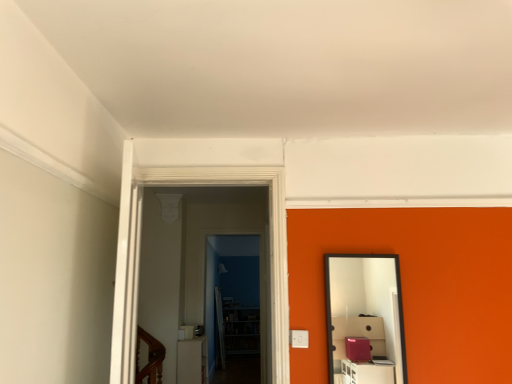
You are a GUI agent. You are given a task and a screenshot of the screen. Output one action in this format:
    pyautogui.click(x=<x>, y=<y>)
    Task: Click on the black framed mirror at right
    
    Given the screenshot: What is the action you would take?
    pyautogui.click(x=365, y=318)

What is the approximate height of transparent glass door at center, arranged as the first glass door when viewed from the back?

5.51 feet.

Measure the distance between transparent glass door at center, positioned as the 1th glass door in front-to-back order, and camera.

The depth of transparent glass door at center, positioned as the 1th glass door in front-to-back order, is 2.21 meters.

Measure the distance between point (136, 243) and camera.

Point (136, 243) is 6.19 feet away from camera.

You are a GUI agent. You are given a task and a screenshot of the screen. Output one action in this format:
    pyautogui.click(x=<x>, y=<y>)
    Task: Click on the white glossy light switch at center
    The width and height of the screenshot is (512, 384).
    Given the screenshot: What is the action you would take?
    pyautogui.click(x=192, y=360)

The height and width of the screenshot is (384, 512). What are the coordinates of `black framed mirror at right` in the screenshot? It's located at (365, 318).

Is black framed mirror at right oriented towards transparent glass door at center, arranged as the first glass door when viewed from the back?

No, black framed mirror at right does not turn towards transparent glass door at center, arranged as the first glass door when viewed from the back.

From a real-world perspective, is black framed mirror at right over transparent glass door at center, arranged as the first glass door when viewed from the back?

Yes, from a real-world perspective, black framed mirror at right is on top of transparent glass door at center, arranged as the first glass door when viewed from the back.

Based on the photo, is black framed mirror at right at the left side of transparent glass door at center, arranged as the first glass door when viewed from the back?

No, black framed mirror at right is not to the left of transparent glass door at center, arranged as the first glass door when viewed from the back.

Is black framed mirror at right shorter than transparent glass door at center, arranged as the first glass door when viewed from the back?

Correct, black framed mirror at right is not as tall as transparent glass door at center, arranged as the first glass door when viewed from the back.

Would you say white glossy light switch at center contains black framed mirror at right?

No, black framed mirror at right is not a part of white glossy light switch at center.

Is point (198, 353) farther from viewer compared to point (358, 337)?

Yes, point (198, 353) is farther from viewer.

Could you tell me if white glossy light switch at center is turned towards black framed mirror at right?

No, white glossy light switch at center is not oriented towards black framed mirror at right.

How different are the orientations of white glossy light switch at center and black framed mirror at right in degrees?

The angle between the facing direction of white glossy light switch at center and the facing direction of black framed mirror at right is 86.3 degrees.

Based on the photo, can you confirm if transparent glass door at center, arranged as the first glass door when viewed from the back, is bigger than white glossy light switch at center?

Incorrect, transparent glass door at center, arranged as the first glass door when viewed from the back, is not larger than white glossy light switch at center.

Image resolution: width=512 pixels, height=384 pixels. What are the coordinates of `furniture in front of the transparent glass door at center, arranged as the first glass door when viewed from the back` in the screenshot? It's located at (192, 360).

Which is correct: transparent glass door at center, arranged as the first glass door when viewed from the back, is inside white glossy light switch at center, or outside of it?

transparent glass door at center, arranged as the first glass door when viewed from the back, exists outside the volume of white glossy light switch at center.

Is transparent glass door at center, arranged as the first glass door when viewed from the back, taller or shorter than white glossy light switch at center?

Considering their sizes, transparent glass door at center, arranged as the first glass door when viewed from the back, has more height than white glossy light switch at center.

How many degrees apart are the facing directions of transparent glass door at center, arranged as the first glass door when viewed from the back, and black framed mirror at right?

transparent glass door at center, arranged as the first glass door when viewed from the back, and black framed mirror at right are facing 0.342 degrees away from each other.

Is transparent glass door at center, acting as the second glass door starting from the front, oriented towards black framed mirror at right?

No, transparent glass door at center, acting as the second glass door starting from the front, does not turn towards black framed mirror at right.

In the image, there is a black framed mirror at right. Where is `glass door below it (from a real-world perspective)`? glass door below it (from a real-world perspective) is located at coordinates (234, 306).

Which of these two, transparent glass door at center, arranged as the first glass door when viewed from the back, or black framed mirror at right, is bigger?

transparent glass door at center, arranged as the first glass door when viewed from the back.

From the picture: Between black framed mirror at right and white glossy light switch at center, which one is positioned in front?

Positioned in front is black framed mirror at right.

Considering the sizes of objects black framed mirror at right and white glossy light switch at center in the image provided, who is shorter, black framed mirror at right or white glossy light switch at center?

white glossy light switch at center is shorter.

Looking at this image, from the image's perspective, is black framed mirror at right on top of white glossy light switch at center?

Yes, from the image's perspective, black framed mirror at right is above white glossy light switch at center.

Is black framed mirror at right looking in the opposite direction of white glossy light switch at center?

No, white glossy light switch at center is not at the back of black framed mirror at right.

Considering the relative positions of white glossy light switch at center and transparent glass door at center, acting as the second glass door starting from the front, in the image provided, is white glossy light switch at center to the left of transparent glass door at center, acting as the second glass door starting from the front, from the viewer's perspective?

Indeed, white glossy light switch at center is positioned on the left side of transparent glass door at center, acting as the second glass door starting from the front.

From a real-world perspective, does white glossy light switch at center sit lower than transparent glass door at center, arranged as the first glass door when viewed from the back?

Yes, from a real-world perspective, white glossy light switch at center is beneath transparent glass door at center, arranged as the first glass door when viewed from the back.

Is white glossy light switch at center completely or partially outside of transparent glass door at center, arranged as the first glass door when viewed from the back?

That's correct, white glossy light switch at center is outside of transparent glass door at center, arranged as the first glass door when viewed from the back.

Is white glossy light switch at center positioned in front of transparent glass door at center, acting as the second glass door starting from the front?

Yes, white glossy light switch at center is closer to the viewer.

In the scene shown: From a real-world perspective, does black framed mirror at right stand above transparent glass door at center, positioned as the 1th glass door in front-to-back order?

No, from a real-world perspective, black framed mirror at right is not over transparent glass door at center, positioned as the 1th glass door in front-to-back order

Which is behind, point (346, 325) or point (137, 272)?

Point (346, 325)

The height and width of the screenshot is (384, 512). In the image, there is a black framed mirror at right. Identify the location of glass door above it (from the image's perspective). (270, 238).

Is black framed mirror at right thinner than transparent glass door at center, positioned as the 1th glass door in front-to-back order?

Correct, the width of black framed mirror at right is less than that of transparent glass door at center, positioned as the 1th glass door in front-to-back order.

You are a GUI agent. You are given a task and a screenshot of the screen. Output one action in this format:
    pyautogui.click(x=<x>, y=<y>)
    Task: Click on the glass door that is under the black framed mirror at right (from a real-world perspective)
    Image resolution: width=512 pixels, height=384 pixels.
    Given the screenshot: What is the action you would take?
    pyautogui.click(x=234, y=306)

This screenshot has height=384, width=512. I want to click on mirror lying above the white glossy light switch at center (from the image's perspective), so click(365, 318).

From the image, which object appears to be nearer to transparent glass door at center, acting as the second glass door starting from the front, transparent glass door at center, positioned as the 1th glass door in front-to-back order, or white glossy light switch at center?

Based on the image, white glossy light switch at center appears to be nearer to transparent glass door at center, acting as the second glass door starting from the front.

Looking at this image, estimate the real-world distances between objects in this image. Which object is further from transparent glass door at center, acting as the second glass door starting from the front, white glossy light switch at center or black framed mirror at right?

The object further to transparent glass door at center, acting as the second glass door starting from the front, is black framed mirror at right.

Which object lies nearer to the anchor point transparent glass door at center, arranged as the first glass door when viewed from the back, transparent glass door at center, the 2th glass door when ordered from back to front, or black framed mirror at right?

black framed mirror at right.

Looking at the image, which one is located further to transparent glass door at center, arranged as the first glass door when viewed from the back, black framed mirror at right or transparent glass door at center, positioned as the 1th glass door in front-to-back order?

transparent glass door at center, positioned as the 1th glass door in front-to-back order, is positioned further to the anchor transparent glass door at center, arranged as the first glass door when viewed from the back.

When comparing their distances from transparent glass door at center, positioned as the 1th glass door in front-to-back order, does transparent glass door at center, arranged as the first glass door when viewed from the back, or white glossy light switch at center seem further?

Among the two, transparent glass door at center, arranged as the first glass door when viewed from the back, is located further to transparent glass door at center, positioned as the 1th glass door in front-to-back order.

Estimate the real-world distances between objects in this image. Which object is closer to transparent glass door at center, positioned as the 1th glass door in front-to-back order, white glossy light switch at center or transparent glass door at center, acting as the second glass door starting from the front?

The object closer to transparent glass door at center, positioned as the 1th glass door in front-to-back order, is white glossy light switch at center.

Based on their spatial positions, is black framed mirror at right or transparent glass door at center, arranged as the first glass door when viewed from the back, closer to transparent glass door at center, the 2th glass door when ordered from back to front?

black framed mirror at right is closer to transparent glass door at center, the 2th glass door when ordered from back to front.

Looking at the image, which one is located further to transparent glass door at center, arranged as the first glass door when viewed from the back, black framed mirror at right or white glossy light switch at center?

The object further to transparent glass door at center, arranged as the first glass door when viewed from the back, is black framed mirror at right.

At what (x,y) coordinates should I click in order to perform the action: click on furniture between transparent glass door at center, the 2th glass door when ordered from back to front, and transparent glass door at center, arranged as the first glass door when viewed from the back, along the z-axis. Please return your answer as a coordinate pair (x, y). This screenshot has width=512, height=384. Looking at the image, I should click on (192, 360).

Where is `mirror located between transparent glass door at center, positioned as the 1th glass door in front-to-back order, and white glossy light switch at center in the depth direction`? This screenshot has width=512, height=384. mirror located between transparent glass door at center, positioned as the 1th glass door in front-to-back order, and white glossy light switch at center in the depth direction is located at coordinates (365, 318).

Where is `mirror positioned between transparent glass door at center, positioned as the 1th glass door in front-to-back order, and transparent glass door at center, acting as the second glass door starting from the front, from near to far`? mirror positioned between transparent glass door at center, positioned as the 1th glass door in front-to-back order, and transparent glass door at center, acting as the second glass door starting from the front, from near to far is located at coordinates (365, 318).

Locate an element on the screen. furniture positioned between black framed mirror at right and transparent glass door at center, acting as the second glass door starting from the front, from near to far is located at coordinates (192, 360).